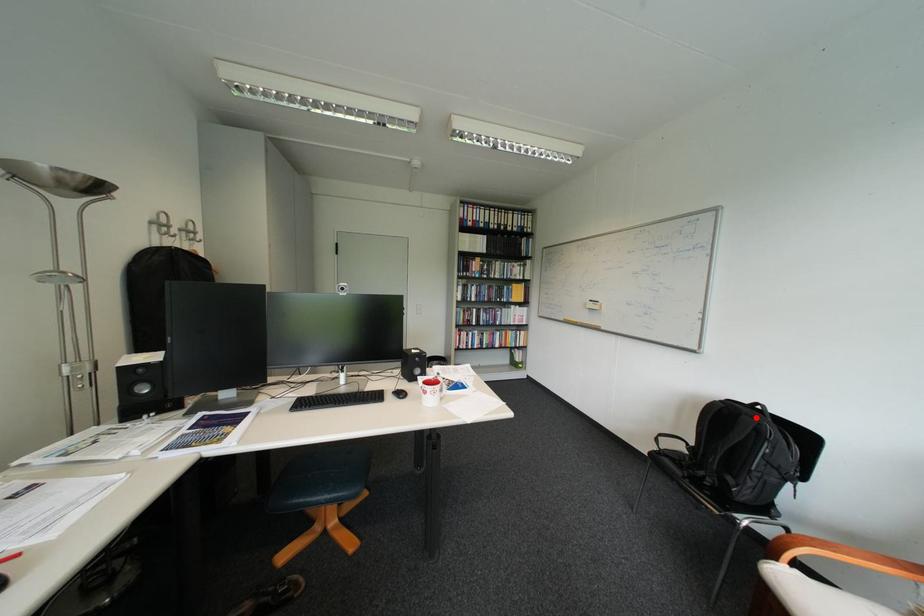
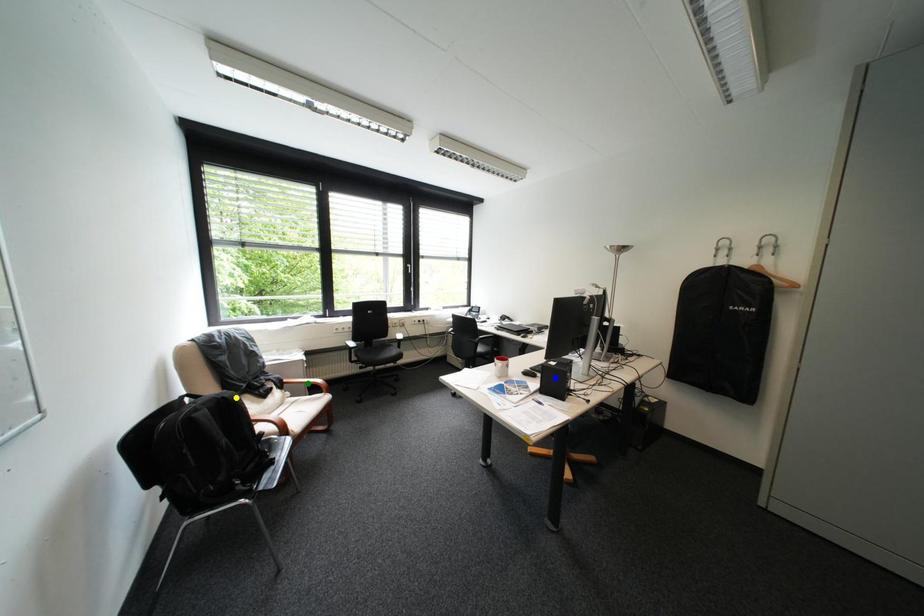
Question: I am providing you with two images of the same scene from different viewpoints. A red point is marked on the first image. You are given multiple points on the second image. In image 2, which mark is for the same physical point as the one in image 1?

Choices:
 (A) blue point
 (B) yellow point
 (C) green point

Answer: (B)